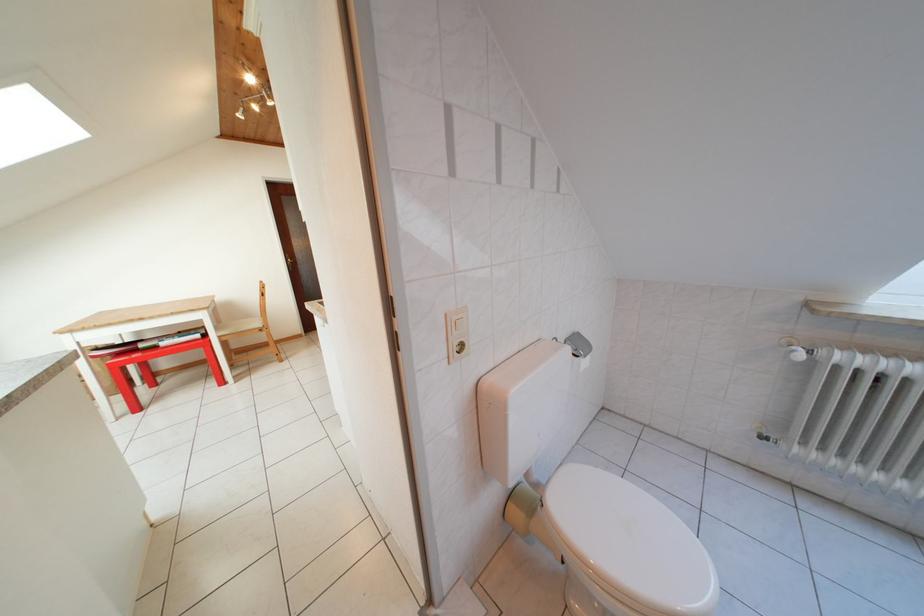
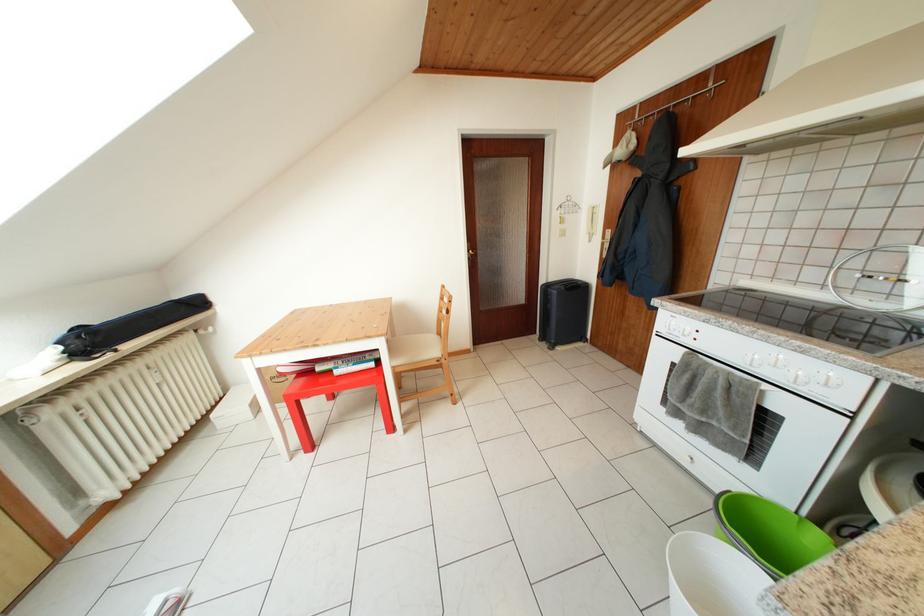
In the second image, find the point that corresponds to the point at 164,352 in the first image.

(338, 377)